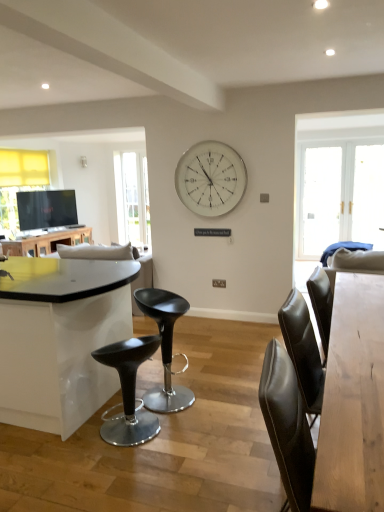
Question: From the image's perspective, does shiny black stool at center appear higher than white fabric couch at center?

Choices:
 (A) no
 (B) yes

Answer: (A)

Question: Is shiny black stool at center located outside white fabric couch at center?

Choices:
 (A) yes
 (B) no

Answer: (A)

Question: Can you confirm if shiny black stool at center is thinner than white fabric couch at center?

Choices:
 (A) yes
 (B) no

Answer: (A)

Question: Could white fabric couch at center be considered to be inside shiny black stool at center?

Choices:
 (A) yes
 (B) no

Answer: (B)

Question: Is shiny black stool at center positioned in front of white fabric couch at center?

Choices:
 (A) no
 (B) yes

Answer: (B)

Question: From the image's perspective, is shiny black stool at center under white fabric couch at center?

Choices:
 (A) no
 (B) yes

Answer: (B)

Question: From the image's perspective, would you say matte black table at left, which is counted as the 1th table, starting from the left, is shown under light brown wooden table at right, the 2th table viewed from the back?

Choices:
 (A) no
 (B) yes

Answer: (A)

Question: From the image's perspective, does matte black table at left, which is counted as the 1th table, starting from the left, appear higher than light brown wooden table at right, placed as the first table when sorted from front to back?

Choices:
 (A) no
 (B) yes

Answer: (B)

Question: Is matte black table at left, the second table from the right, directly adjacent to light brown wooden table at right, the 2th table viewed from the back?

Choices:
 (A) yes
 (B) no

Answer: (B)

Question: Is matte black table at left, which is counted as the 1th table, starting from the left, smaller than light brown wooden table at right, the first table when ordered from right to left?

Choices:
 (A) yes
 (B) no

Answer: (A)

Question: Is matte black table at left, positioned as the 1th table in back-to-front order, further to camera compared to light brown wooden table at right, which appears as the 2th table when viewed from the left?

Choices:
 (A) yes
 (B) no

Answer: (A)

Question: From a real-world perspective, does matte black table at left, which is counted as the 1th table, starting from the left, sit lower than light brown wooden table at right, acting as the 1th table starting from the bottom?

Choices:
 (A) no
 (B) yes

Answer: (A)

Question: Considering the relative positions of shiny black stool at center and black plastic stool at center in the image provided, is shiny black stool at center behind black plastic stool at center?

Choices:
 (A) yes
 (B) no

Answer: (B)